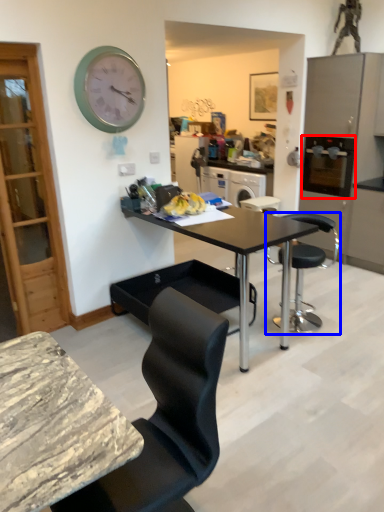
Question: Which point is closer to the camera, appliance (highlighted by a red box) or chair (highlighted by a blue box)?

Choices:
 (A) appliance
 (B) chair

Answer: (B)